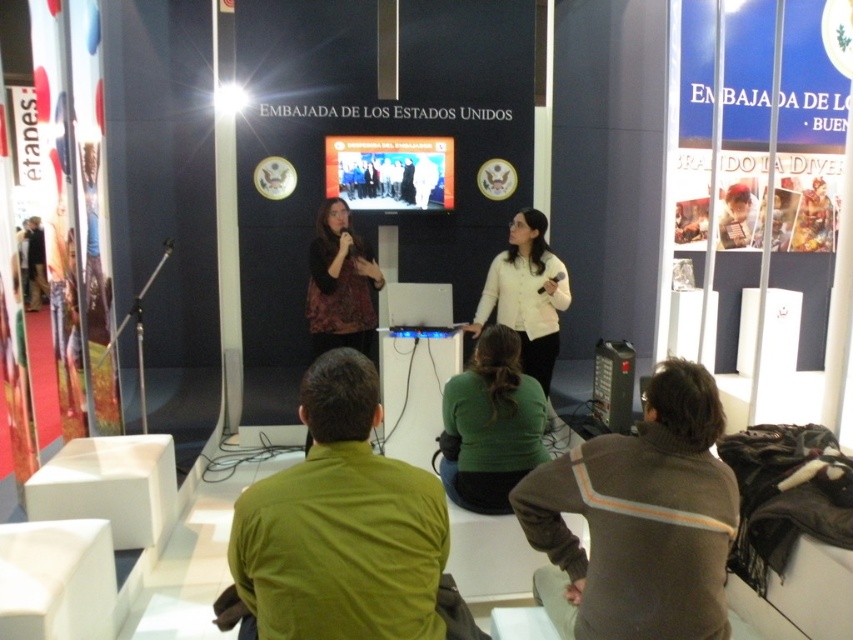
Looking at this image, does green matte shirt at lower center have a lesser height compared to patterned fabric shirt at center?

Indeed, green matte shirt at lower center has a lesser height compared to patterned fabric shirt at center.

The image size is (853, 640). I want to click on green matte shirt at lower center, so click(x=341, y=525).

The height and width of the screenshot is (640, 853). Describe the element at coordinates (341, 525) in the screenshot. I see `green matte shirt at lower center` at that location.

Locate an element on the screen. The width and height of the screenshot is (853, 640). green matte shirt at lower center is located at coordinates (341, 525).

Can you confirm if brown sweater at lower right is positioned to the left of white matte shirt at center?

Correct, you'll find brown sweater at lower right to the left of white matte shirt at center.

Locate an element on the screen. The width and height of the screenshot is (853, 640). brown sweater at lower right is located at coordinates (637, 520).

Is green matte shirt at lower center below white matte shirt at center?

Indeed, green matte shirt at lower center is positioned under white matte shirt at center.

Does point (387, 532) come in front of point (480, 326)?

That is True.

Locate an element on the screen. Image resolution: width=853 pixels, height=640 pixels. green matte shirt at lower center is located at coordinates (341, 525).